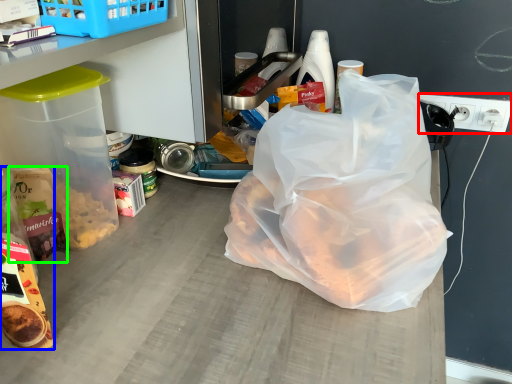
Question: Which is farther away from electric outlet (highlighted by a red box)? snack (highlighted by a blue box) or cereal (highlighted by a green box)?

Choices:
 (A) snack
 (B) cereal

Answer: (A)